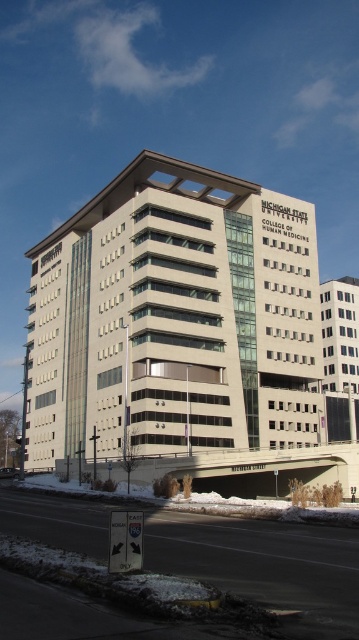
Does white powdery snow at lower left appear on the left side of white powdery snow at lower center?

Indeed, white powdery snow at lower left is positioned on the left side of white powdery snow at lower center.

Consider the image. Between white powdery snow at lower left and white powdery snow at lower center, which one is positioned higher?

white powdery snow at lower left

Does point (356, 557) lie in front of point (82, 493)?

Yes, it is in front of point (82, 493).

The width and height of the screenshot is (359, 640). Find the location of `white powdery snow at lower left`. white powdery snow at lower left is located at coordinates tap(264, 564).